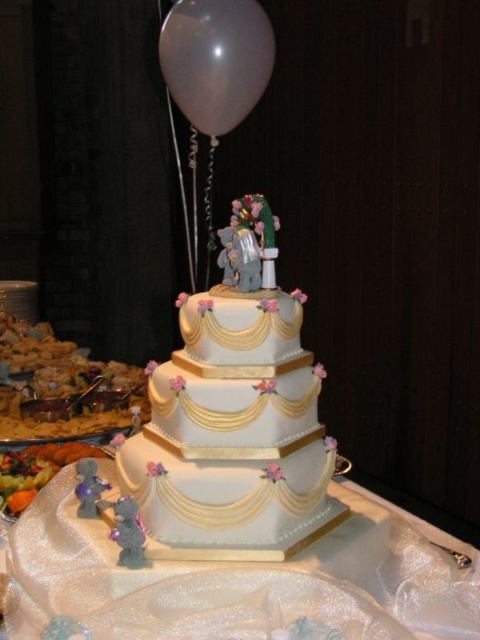
Question: Considering the real-world distances, which object is farthest from the white matte balloon at upper center?

Choices:
 (A) white fondant cake at center
 (B) white satin tablecloth at center

Answer: (B)

Question: Can you confirm if white satin tablecloth at center is positioned to the right of white matte balloon at upper center?

Choices:
 (A) yes
 (B) no

Answer: (A)

Question: Can you confirm if white satin tablecloth at center is bigger than white matte balloon at upper center?

Choices:
 (A) no
 (B) yes

Answer: (A)

Question: Which object is closer to the camera taking this photo?

Choices:
 (A) white satin tablecloth at center
 (B) white fondant cake at center

Answer: (A)

Question: Which of the following is the farthest from the observer?

Choices:
 (A) white satin tablecloth at center
 (B) white fondant cake at center
 (C) white matte balloon at upper center

Answer: (C)

Question: Can you confirm if white fondant cake at center is positioned above white matte balloon at upper center?

Choices:
 (A) no
 (B) yes

Answer: (A)